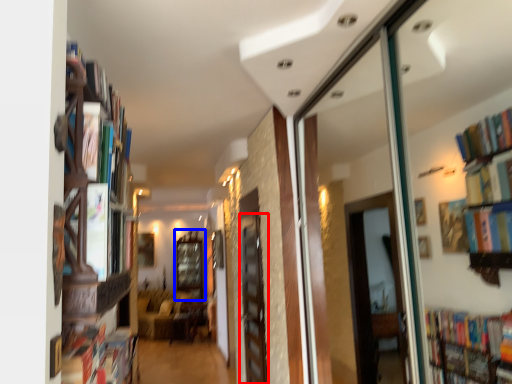
Question: Which object appears farthest to the camera in this image, screen door (highlighted by a red box) or window (highlighted by a blue box)?

Choices:
 (A) screen door
 (B) window

Answer: (B)